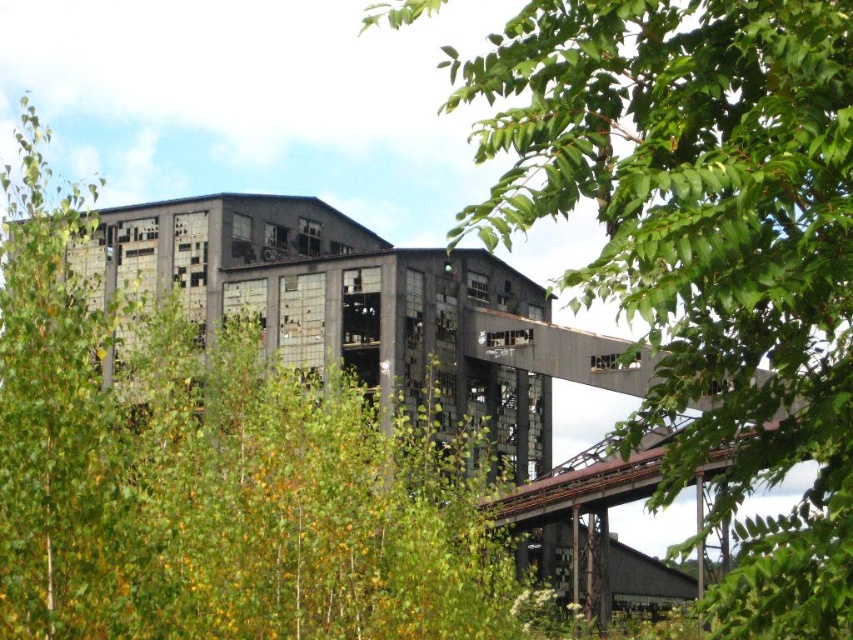
You are a botanist examining the green leafy tree at upper right and the green leafy tree at center in the image. Which tree has a smaller width?

The green leafy tree at upper right has a lesser width compared to the green leafy tree at center.

You are a park ranger planning to clear a path between the green leafy tree at upper right and the green leafy tree at center. Given that your equipment can handle up to 25 meters of distance, will you be able to complete the task in one go?

The distance between the green leafy tree at upper right and the green leafy tree at center is 26.74 meters, which exceeds the equipment capacity of 25 meters. Therefore, the task cannot be completed in one go.

Looking at the abandoned industrial building with its overgrown greenery, which tree is positioned to the right side of the other? Specifically, is the green leafy tree at upper right located to the right of the green leafy tree at center?

The green leafy tree at upper right is to the right of the green leafy tree at center.